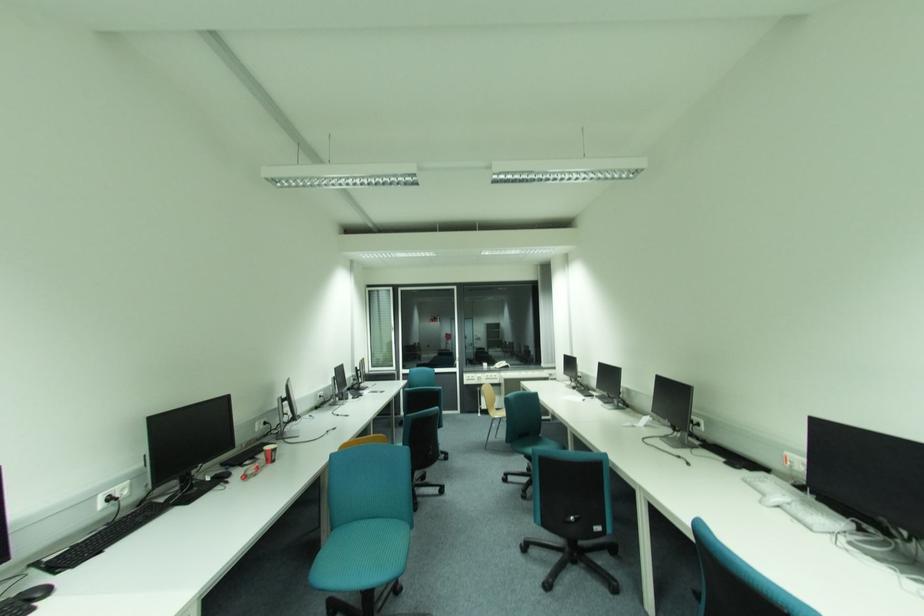
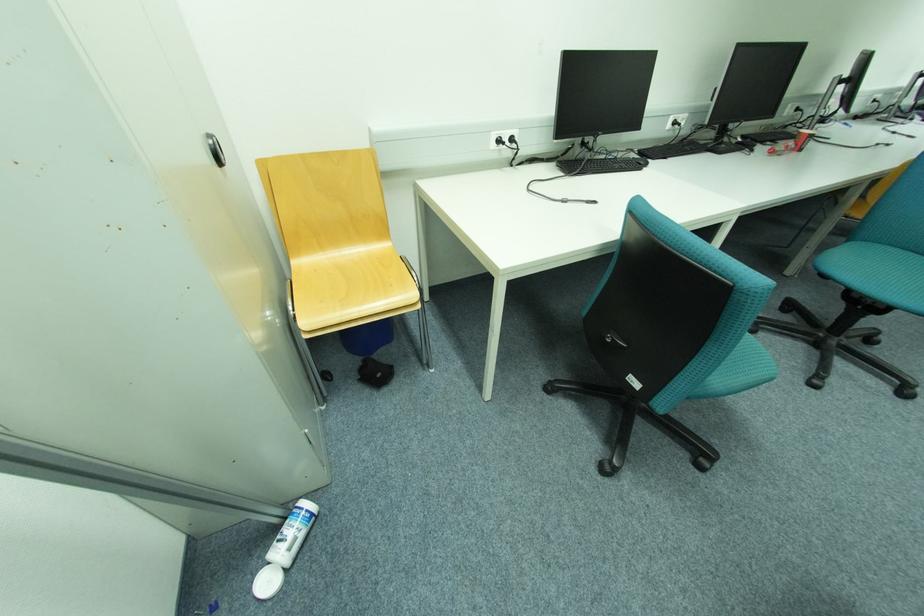
Where in the second image is the point corresponding to point 107,506 from the first image?

(675, 126)